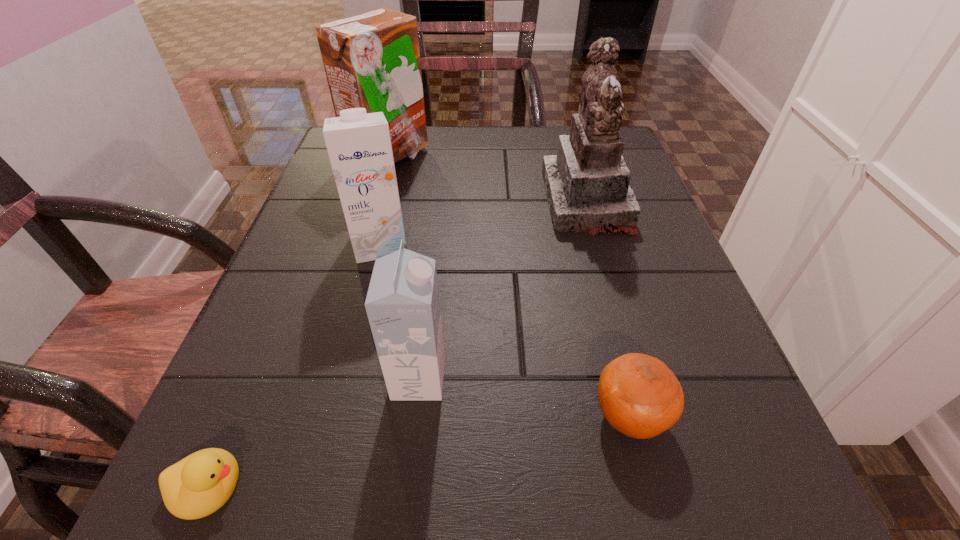
I want to click on figurine, so click(x=587, y=186).

I want to click on the farthest carton, so click(372, 60).

Where is `the second nearest carton`? the second nearest carton is located at coordinates (359, 146).

Identify the location of the nearest carton. (402, 303).

At what (x,y) coordinates should I click in order to perform the action: click on the rightmost carton. Please return your answer as a coordinate pair (x, y). This screenshot has width=960, height=540. Looking at the image, I should click on (402, 303).

Locate an element on the screen. This screenshot has width=960, height=540. the fifth tallest object is located at coordinates (639, 395).

Image resolution: width=960 pixels, height=540 pixels. I want to click on the nearest object, so click(198, 485).

Locate an element on the screen. the shortest object is located at coordinates (198, 485).

Locate an element on the screen. This screenshot has width=960, height=540. free location located on the front-facing side of the figurine is located at coordinates coord(369,201).

Where is `vacant space situated on the front-facing side of the figurine`? vacant space situated on the front-facing side of the figurine is located at coordinates click(x=398, y=201).